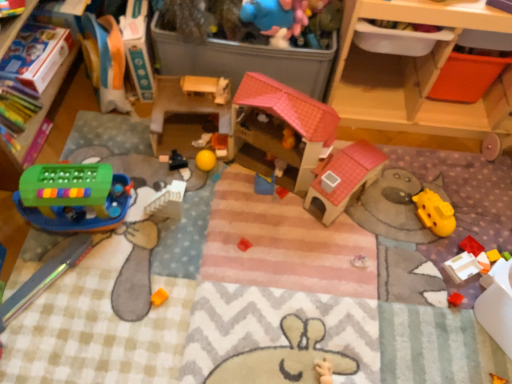
Identify the location of blank area to the left of yellow rubber ball at center, which is counted as the 4th toy, starting from the right. The height and width of the screenshot is (384, 512). (172, 153).